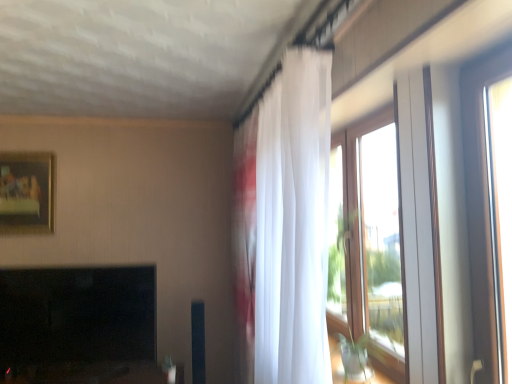
Question: From a real-world perspective, is clear glass window at right located higher than white sheer curtain at upper right?

Choices:
 (A) no
 (B) yes

Answer: (B)

Question: Can you confirm if clear glass window at right is shorter than white sheer curtain at upper right?

Choices:
 (A) yes
 (B) no

Answer: (A)

Question: Is clear glass window at right not close to white sheer curtain at upper right?

Choices:
 (A) no
 (B) yes

Answer: (A)

Question: Considering the relative positions of clear glass window at right and white sheer curtain at upper right in the image provided, is clear glass window at right behind white sheer curtain at upper right?

Choices:
 (A) yes
 (B) no

Answer: (B)

Question: Can you confirm if clear glass window at right is wider than white sheer curtain at upper right?

Choices:
 (A) yes
 (B) no

Answer: (B)

Question: Can you confirm if clear glass window at right is taller than white sheer curtain at upper right?

Choices:
 (A) yes
 (B) no

Answer: (B)

Question: Does black glossy fireplace at lower left have a greater height compared to clear glass window at right?

Choices:
 (A) no
 (B) yes

Answer: (A)

Question: Does black glossy fireplace at lower left have a lesser width compared to clear glass window at right?

Choices:
 (A) yes
 (B) no

Answer: (B)

Question: Does black glossy fireplace at lower left appear on the left side of clear glass window at right?

Choices:
 (A) no
 (B) yes

Answer: (B)

Question: Is black glossy fireplace at lower left oriented towards clear glass window at right?

Choices:
 (A) yes
 (B) no

Answer: (B)

Question: Are black glossy fireplace at lower left and clear glass window at right beside each other?

Choices:
 (A) no
 (B) yes

Answer: (A)

Question: From the image's perspective, is black glossy fireplace at lower left under clear glass window at right?

Choices:
 (A) no
 (B) yes

Answer: (B)

Question: Is white sheer curtain at upper right facing towards clear glass window at right?

Choices:
 (A) yes
 (B) no

Answer: (B)